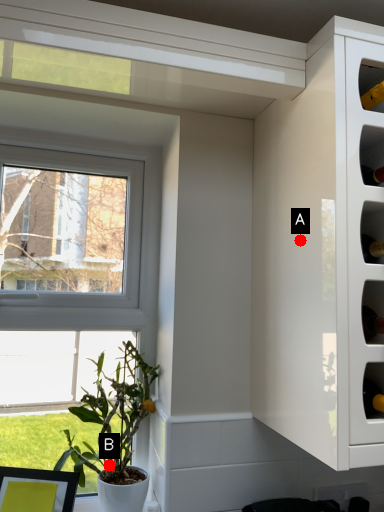
Question: Two points are circled on the image, labeled by A and B beside each circle. Which point is farther from the camera taking this photo?

Choices:
 (A) A is further
 (B) B is further

Answer: (B)